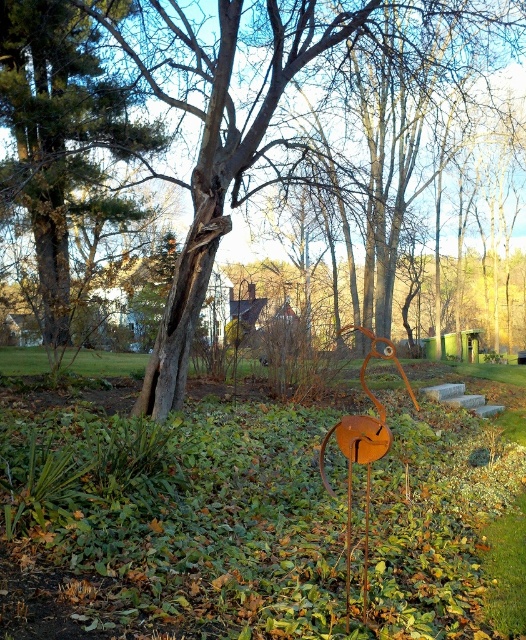
You are standing in the garden and want to take a photo of the green matte grass at center and the brown wood tree at center. Which object will appear closer to the camera in the photo?

The green matte grass at center will appear closer to the camera in the photo because it is positioned in front of the brown wood tree at center.

You are standing in the garden and want to place a 10 feet long bench between the brown wood tree at center and the brown textured tree at upper left. Is there enough space for the bench?

The distance between the brown wood tree at center and the brown textured tree at upper left is 6.66 feet, which is shorter than the 10 feet length of the bench. Therefore, there is not enough space to place the bench between them.

You are standing in the garden and want to place a 1.2 meter wide decorative stone between the green matte grass at center and the brown textured tree at upper left. Will there be enough space for the stone between them?

The distance between the green matte grass at center and the brown textured tree at upper left is 10.57 meters, so placing a 1.2 meter wide decorative stone between them would be possible as there is sufficient space available.